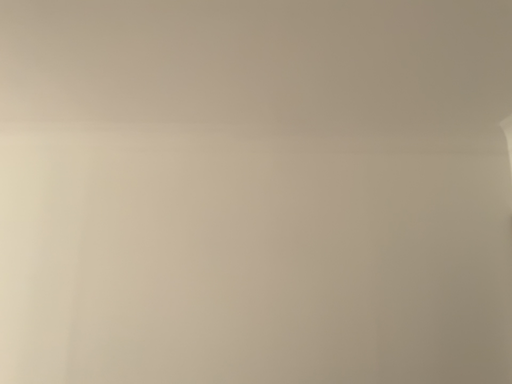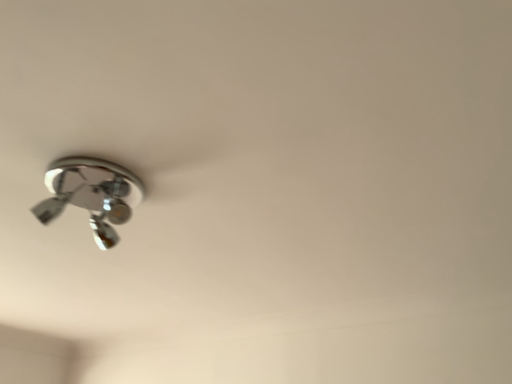
Question: Which way did the camera rotate in the video?

Choices:
 (A) rotated upward
 (B) rotated downward

Answer: (A)